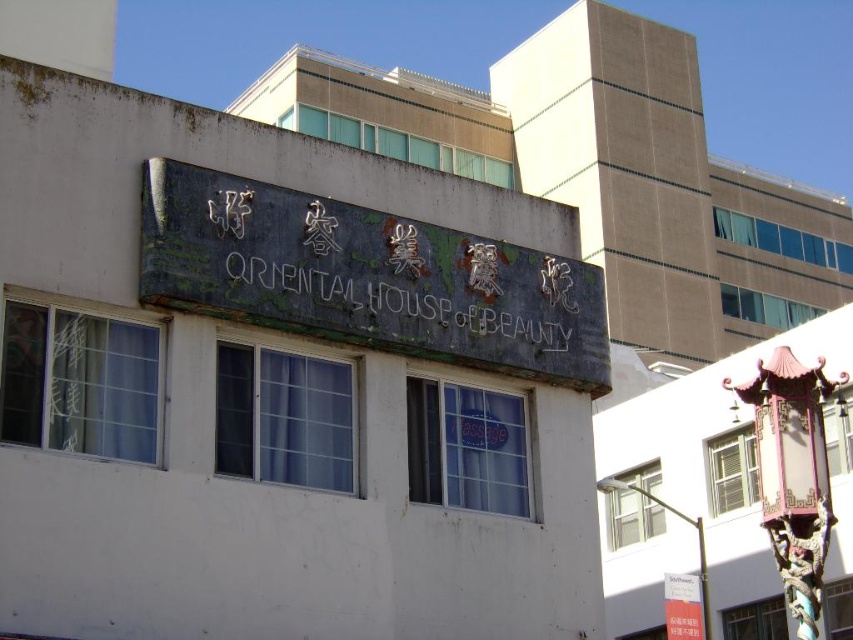
Who is shorter, metallic signboard at center or metallic pole at lower right?

metallic signboard at center

Is metallic signboard at center in front of metallic pole at lower right?

No, metallic signboard at center is behind metallic pole at lower right.

Does point (679, 612) come farther from viewer compared to point (612, 488)?

No, (679, 612) is in front of (612, 488).

Locate an element on the screen. metallic signboard at center is located at coordinates (682, 605).

Does dark green stone sign at center have a greater height compared to metallic pole at lower right?

No.

Does dark green stone sign at center have a lesser width compared to metallic pole at lower right?

No, dark green stone sign at center is not thinner than metallic pole at lower right.

Is point (320, 310) positioned in front of point (601, 490)?

Yes, point (320, 310) is closer to viewer.

The height and width of the screenshot is (640, 853). I want to click on dark green stone sign at center, so click(x=416, y=300).

Identify the location of dark green stone sign at center. (416, 300).

Does dark green stone sign at center appear on the right side of metallic signboard at center?

Incorrect, dark green stone sign at center is not on the right side of metallic signboard at center.

Between point (456, 301) and point (697, 618), which one is positioned behind?

The point (697, 618) is more distant.

Where is `dark green stone sign at center`? The width and height of the screenshot is (853, 640). dark green stone sign at center is located at coordinates (416, 300).